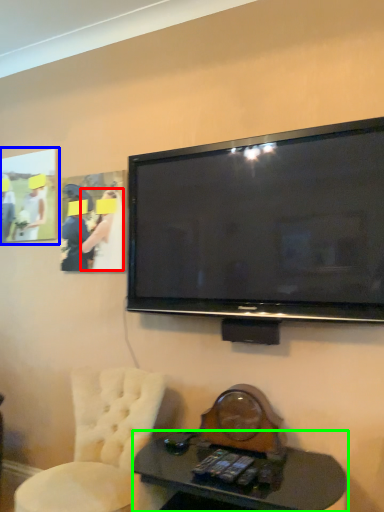
Question: Considering the real-world distances, which object is farthest from person (highlighted by a red box)? picture frame (highlighted by a blue box) or desk (highlighted by a green box)?

Choices:
 (A) picture frame
 (B) desk

Answer: (B)